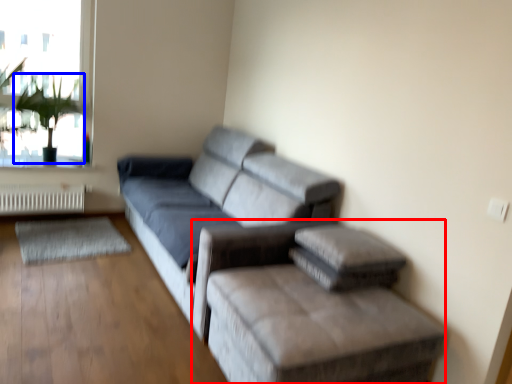
Question: Which point is closer to the camera, furniture (highlighted by a red box) or plant (highlighted by a blue box)?

Choices:
 (A) furniture
 (B) plant

Answer: (A)